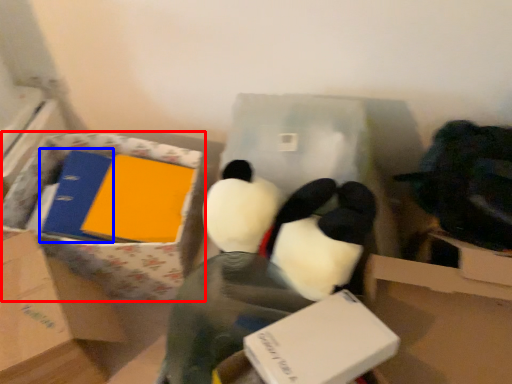
Question: Among these objects, which one is nearest to the camera, cardboard box (highlighted by a red box) or binder (highlighted by a blue box)?

Choices:
 (A) cardboard box
 (B) binder

Answer: (A)